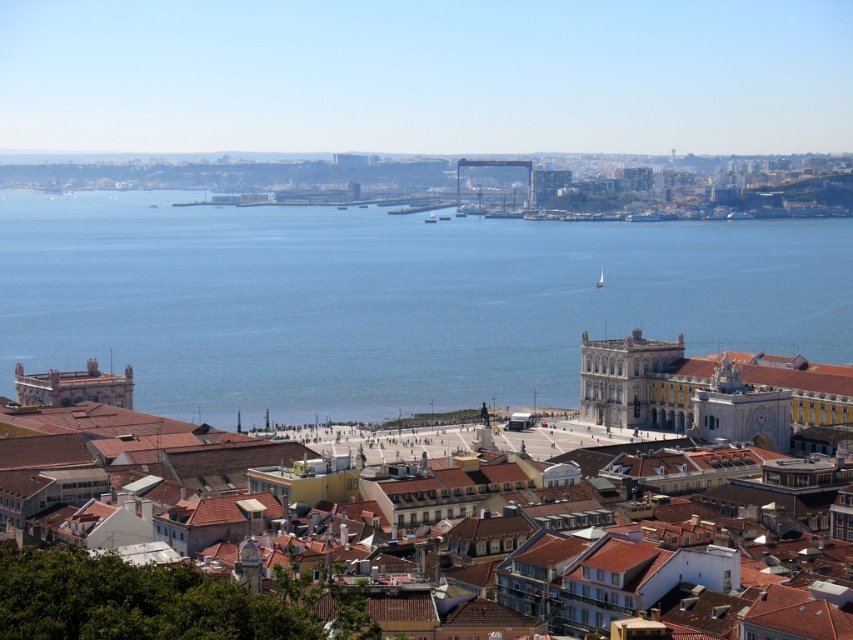
Who is taller, blue water at center or yellow stone building at center?

Standing taller between the two is blue water at center.

Which is more to the left, blue water at center or yellow stone building at center?

yellow stone building at center is more to the left.

This screenshot has height=640, width=853. I want to click on blue water at center, so click(x=389, y=300).